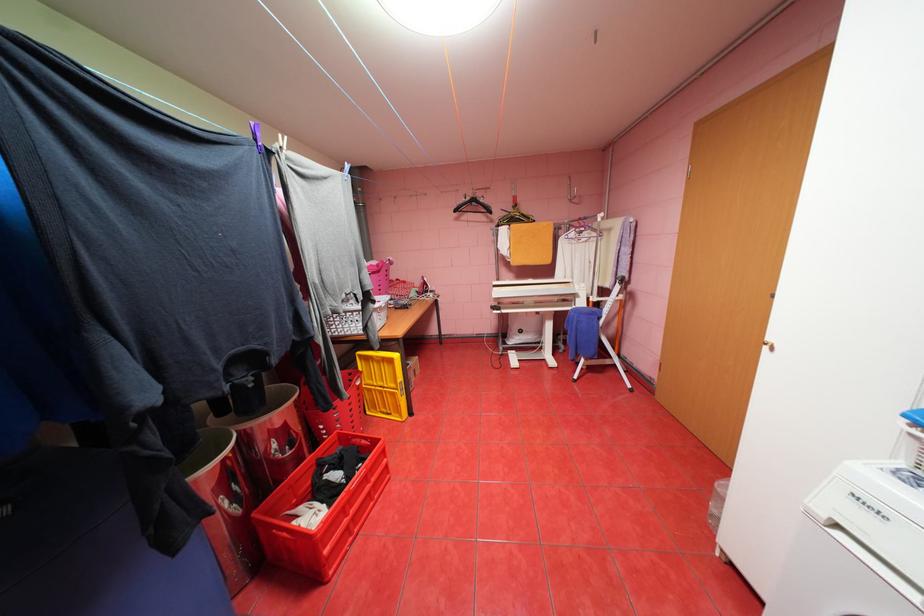
This screenshot has height=616, width=924. Describe the element at coordinates (535, 310) in the screenshot. I see `a white drying rack` at that location.